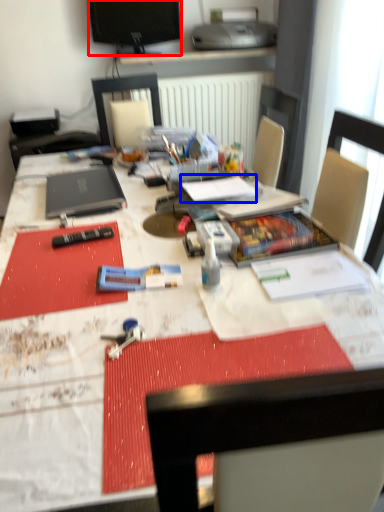
Question: Which point is closer to the camera, television (highlighted by a red box) or notebook (highlighted by a blue box)?

Choices:
 (A) television
 (B) notebook

Answer: (B)